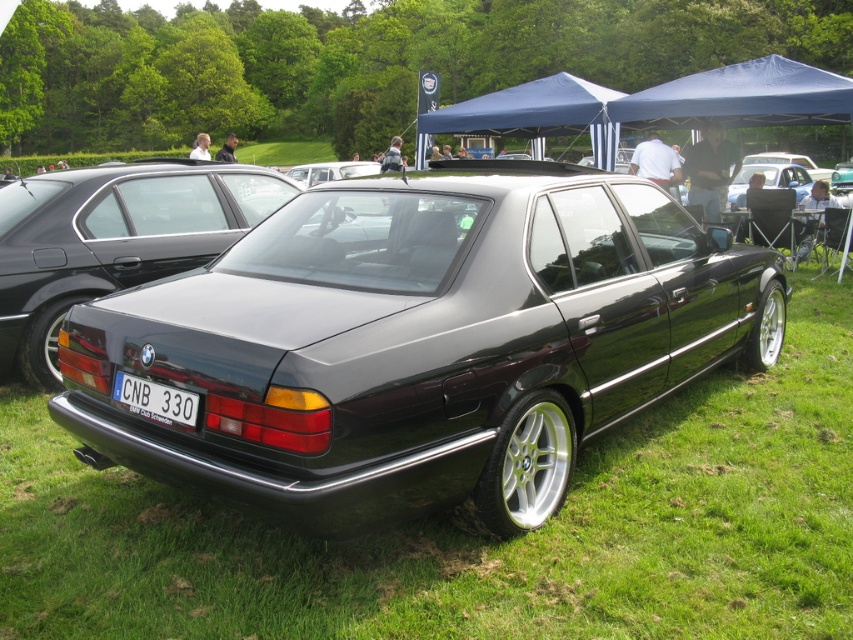
You are a photographer trying to capture the glossy black sedan at center for a magazine cover. You notice the white plastic license plate at center might be distracting. Can you adjust your position to focus more on the car without the license plate being in the frame?

The glossy black sedan at center is closer to the viewer than the white plastic license plate at center, so by moving your camera position slightly forward or adjusting the angle, you can focus on the car while the license plate may become less prominent or move out of the frame.

You are standing at the car show and want to take a photo of the glossy black sedan at center. If your camera can focus on objects up to 10 feet away, will you be able to take a clear photo from your current position?

The glossy black sedan at center is 8.58 feet away from the viewer, which is within the camera focus range of up to 10 feet. Therefore, you can take a clear photo from your current position.

You are a photographer planning to take a closeup shot of the white plastic license plate at center. Considering the glossy black sedan at center, will you need to adjust your camera angle upwards or downwards to focus on the license plate?

The glossy black sedan at center is taller than the white plastic license plate at center, so you will need to adjust your camera angle downwards to focus on the license plate.